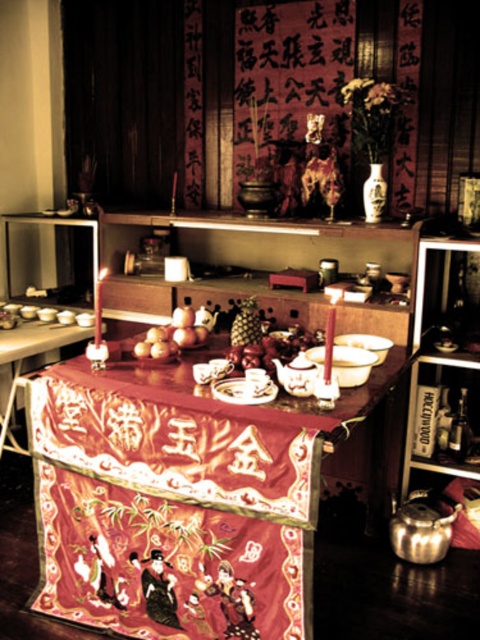
Question: Which point appears farthest from the camera in this image?

Choices:
 (A) (58, 419)
 (B) (238, 353)
 (C) (180, 340)

Answer: (C)

Question: Where is shiny red apples at center located in relation to smooth golden apples at center in the image?

Choices:
 (A) left
 (B) right

Answer: (B)

Question: Which of the following is the closest to the observer?

Choices:
 (A) (178, 557)
 (B) (181, 324)

Answer: (A)

Question: Which point appears closest to the camera in this image?

Choices:
 (A) (248, 364)
 (B) (160, 401)
 (C) (158, 336)

Answer: (B)

Question: Can you confirm if silky red tablecloth at center is wider than smooth golden apples at center?

Choices:
 (A) yes
 (B) no

Answer: (A)

Question: Does silky red tablecloth at center have a lesser width compared to smooth golden apples at center?

Choices:
 (A) no
 (B) yes

Answer: (A)